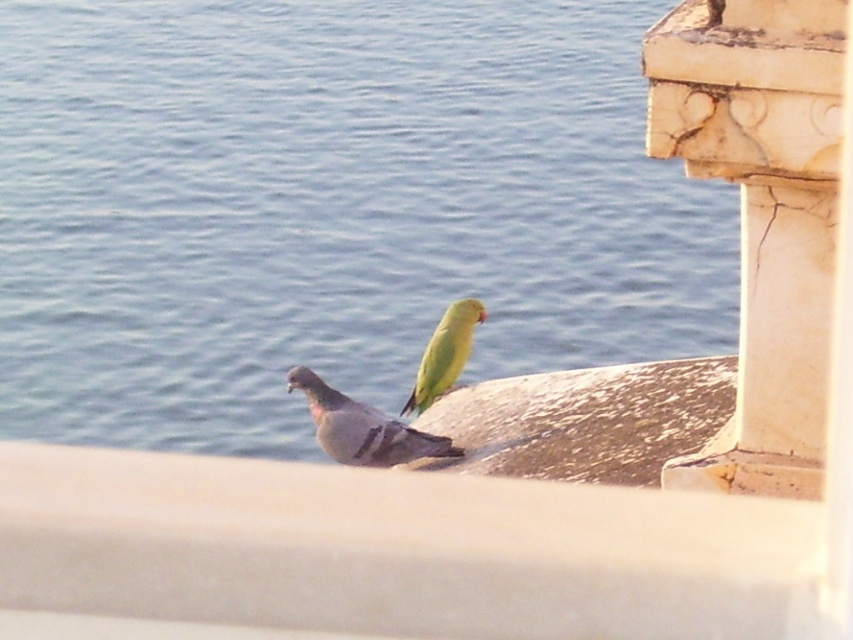
Question: Among these points, which one is farthest from the camera?

Choices:
 (A) (704, 317)
 (B) (344, 426)
 (C) (672, 77)

Answer: (A)

Question: Is white marble pillar at upper right bigger than gray matte pigeon at center?

Choices:
 (A) no
 (B) yes

Answer: (B)

Question: Is gray matte pigeon at center above green matte parrot at center?

Choices:
 (A) yes
 (B) no

Answer: (B)

Question: Which of the following is the farthest from the observer?

Choices:
 (A) green matte parrot at center
 (B) gray matte pigeon at center

Answer: (A)

Question: Which of the following is the farthest from the observer?

Choices:
 (A) green matte parrot at center
 (B) white marble pillar at upper right
 (C) gray matte pigeon at center

Answer: (A)

Question: Can you confirm if blue water at center is positioned to the left of gray matte pigeon at center?

Choices:
 (A) no
 (B) yes

Answer: (B)